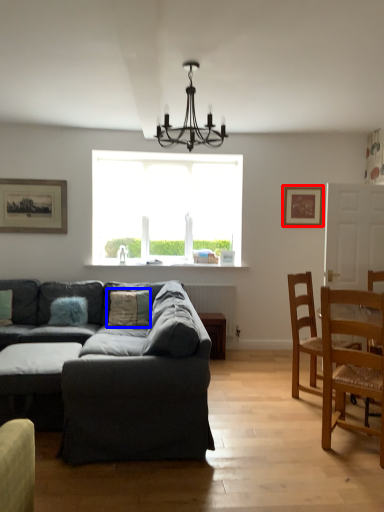
Question: Which object is further to the camera taking this photo, picture frame (highlighted by a red box) or pillow (highlighted by a blue box)?

Choices:
 (A) picture frame
 (B) pillow

Answer: (A)